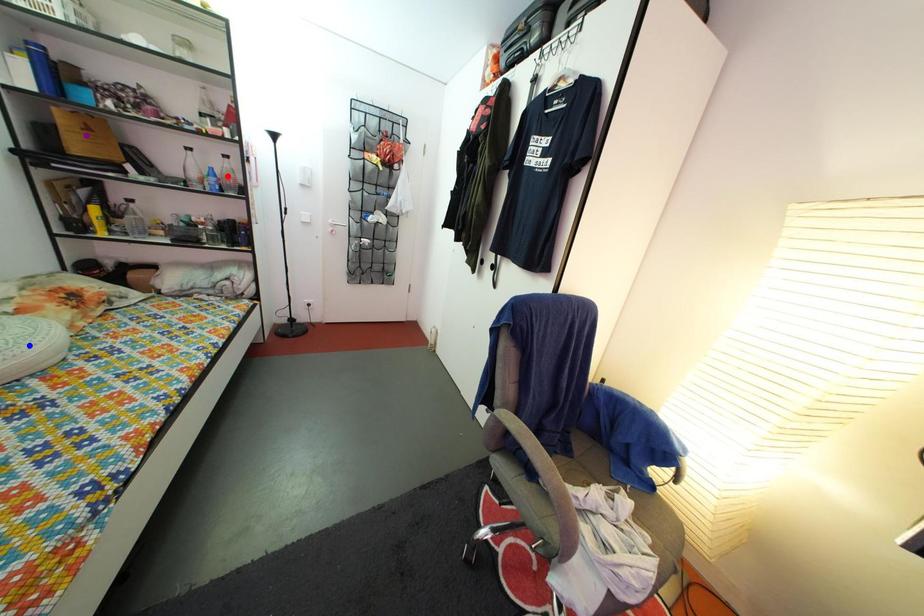
Order these from nearest to farthest:
1. red point
2. blue point
3. purple point

blue point < purple point < red point